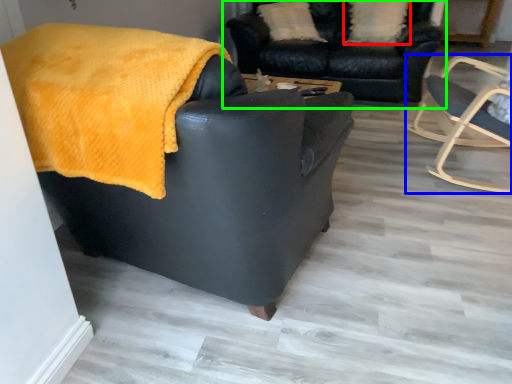
Question: Which is nearer to the pillow (highlighted by a red box)? chair (highlighted by a blue box) or studio couch (highlighted by a green box).

Choices:
 (A) chair
 (B) studio couch

Answer: (B)